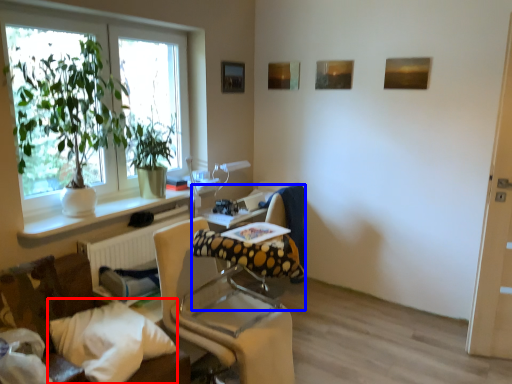
Question: Which of the following is the closest to the observer, pillow (highlighted by a red box) or swivel chair (highlighted by a blue box)?

Choices:
 (A) pillow
 (B) swivel chair

Answer: (A)